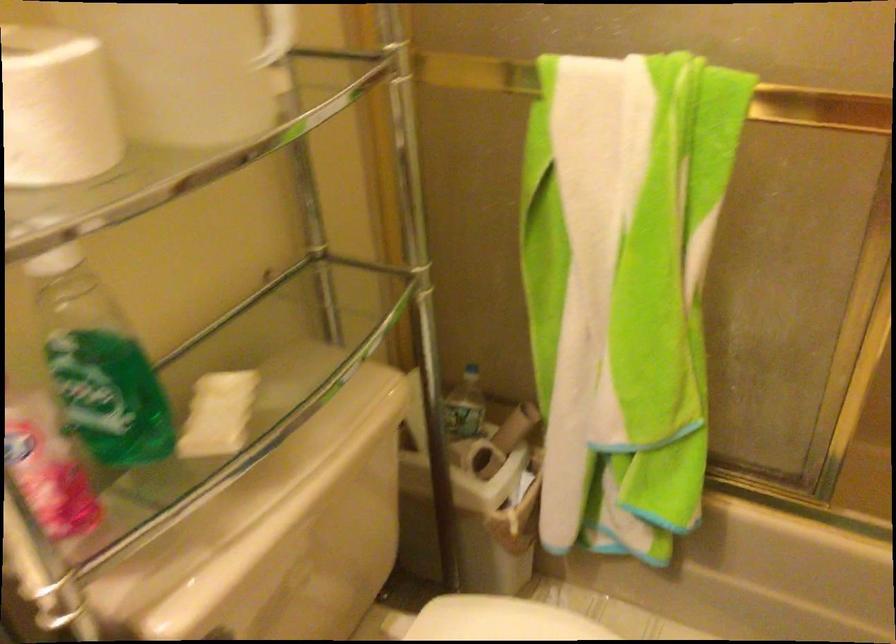
Which object does [98,365] point to?

This point indicates the green soap bottle.